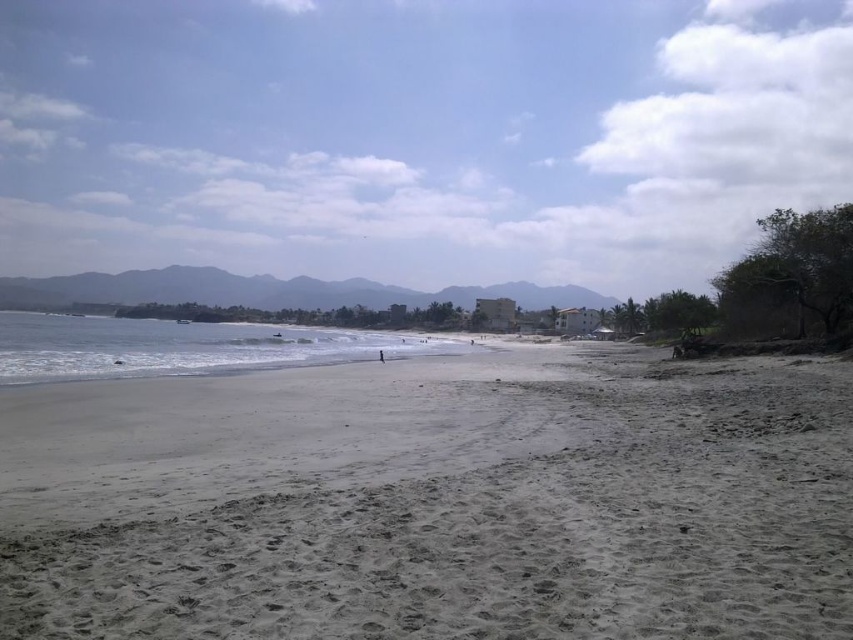
Consider the image. You are standing at the camera position observing the beach scene. There are two points marked in the image, point 1 at coordinates point (809, 552) and point 2 at coordinates point (0, 353). Which point is nearer to your current position?

Point (809, 552) is closer to the camera than point (0, 353), so point 1 is nearer to your current position.